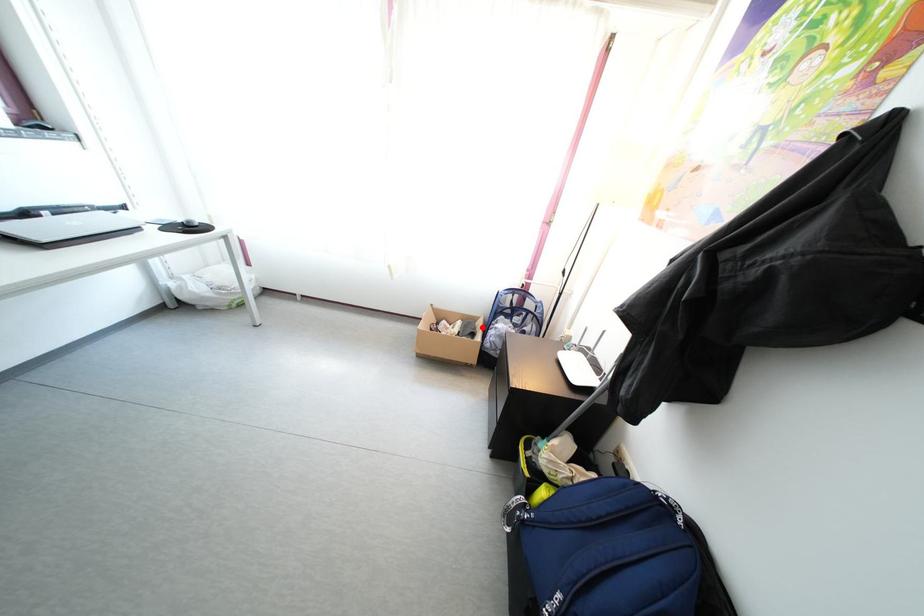
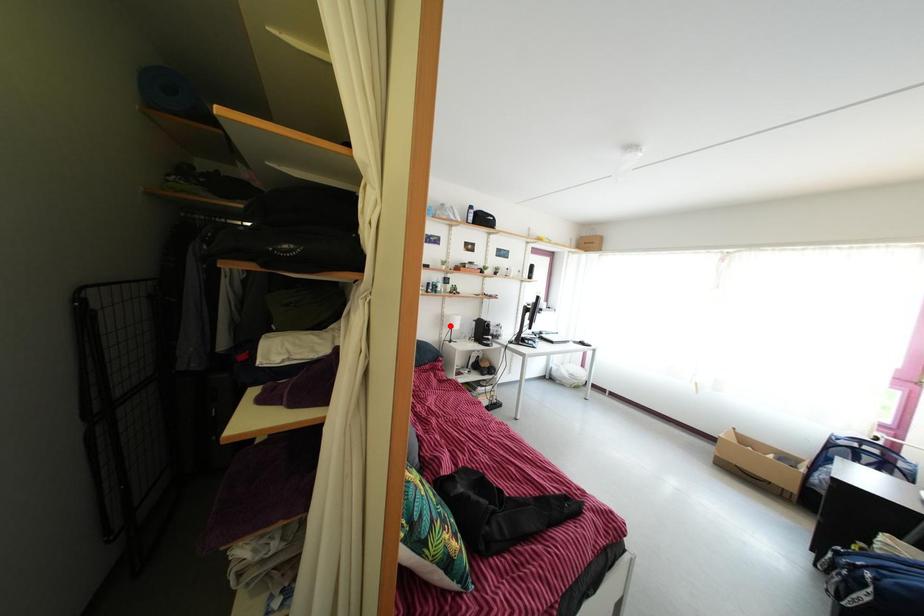
I am providing you with two images of the same scene from different viewpoints. A red point is marked on the first image and another point is marked on the second image. Are the points marked in image1 and image2 representing the same 3D position?

No